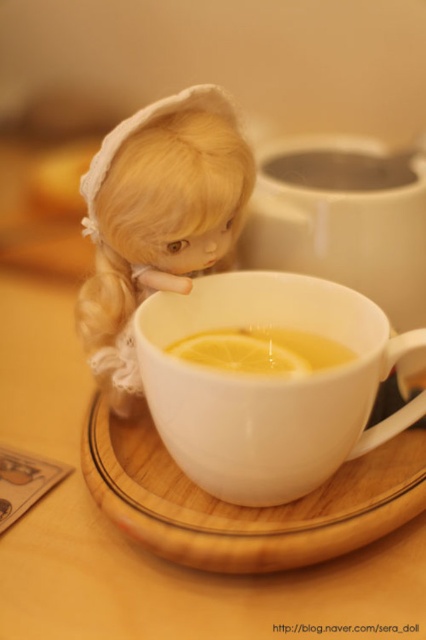
Question: Does wooden saucer at center have a lesser width compared to translucent glass cup at upper center?

Choices:
 (A) no
 (B) yes

Answer: (A)

Question: From the image, what is the correct spatial relationship of matte white doll at upper left in relation to translucent glass cup at upper center?

Choices:
 (A) right
 (B) left

Answer: (B)

Question: Estimate the real-world distances between objects in this image. Which object is farther from the wooden saucer at center?

Choices:
 (A) yellow matte lemon at center
 (B) white glossy teacup at center

Answer: (A)

Question: Which of these objects is positioned closest to the matte white doll at upper left?

Choices:
 (A) white glossy teacup at center
 (B) translucent glass cup at upper center

Answer: (A)

Question: Which object appears closest to the camera in this image?

Choices:
 (A) translucent glass cup at upper center
 (B) yellow matte lemon at center
 (C) matte white doll at upper left

Answer: (C)

Question: Can you confirm if wooden saucer at center is wider than translucent glass cup at upper center?

Choices:
 (A) yes
 (B) no

Answer: (A)